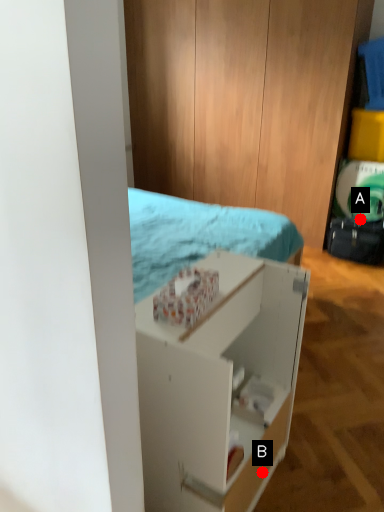
Question: Two points are circled on the image, labeled by A and B beside each circle. Which point is closer to the camera taking this photo?

Choices:
 (A) A is closer
 (B) B is closer

Answer: (B)